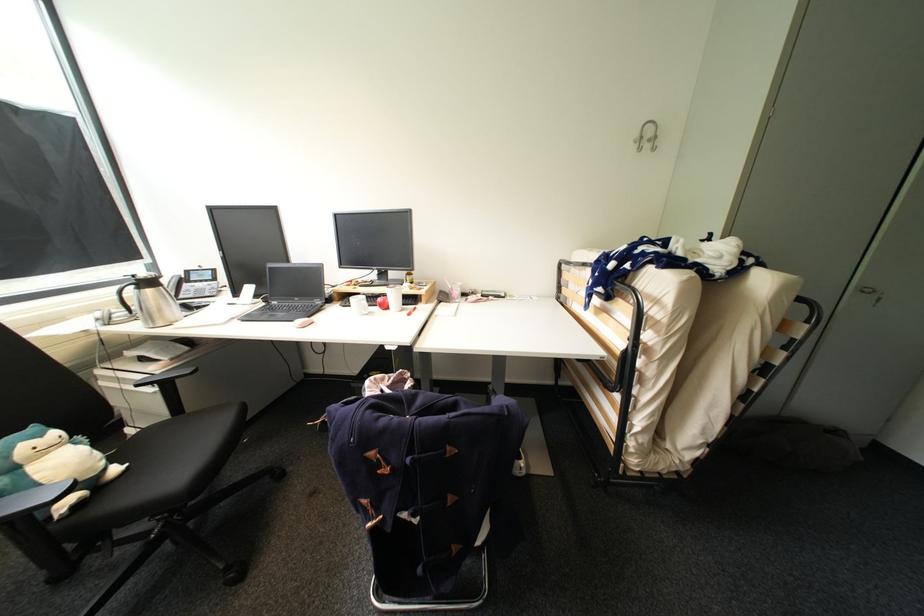
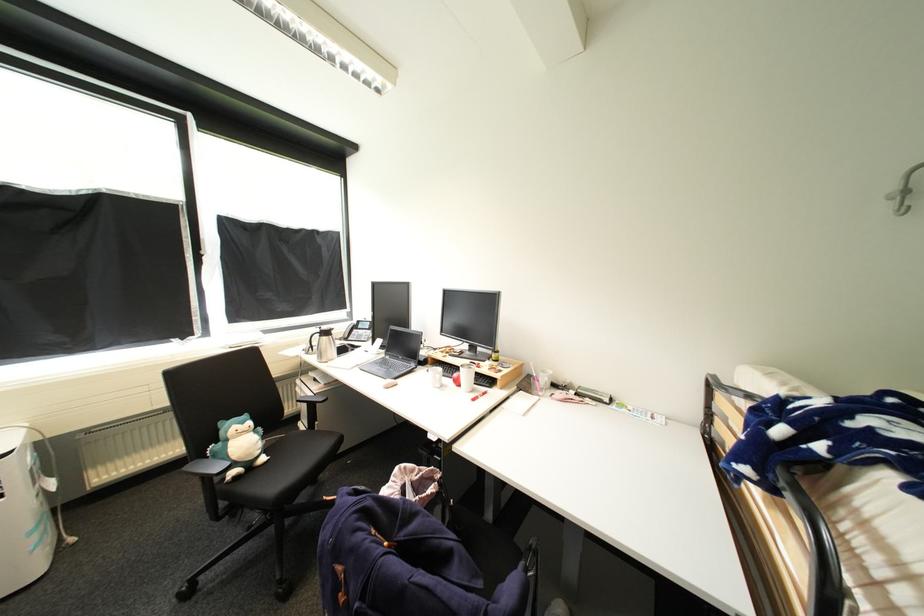
Where in the second image is the point corresponding to [419,411] from the first image?

(408, 537)